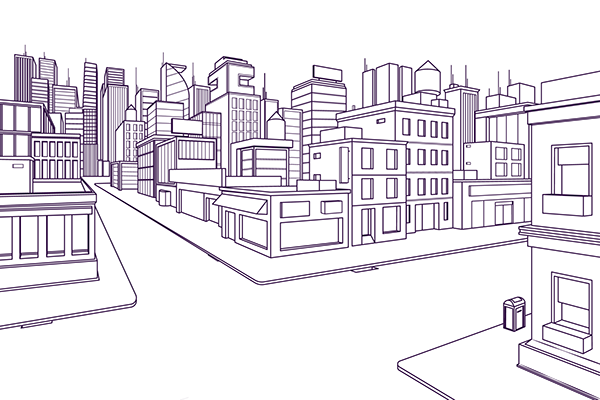
Find the location of a particular element. The width and height of the screenshot is (600, 400). trash can is located at coordinates pos(507,323).